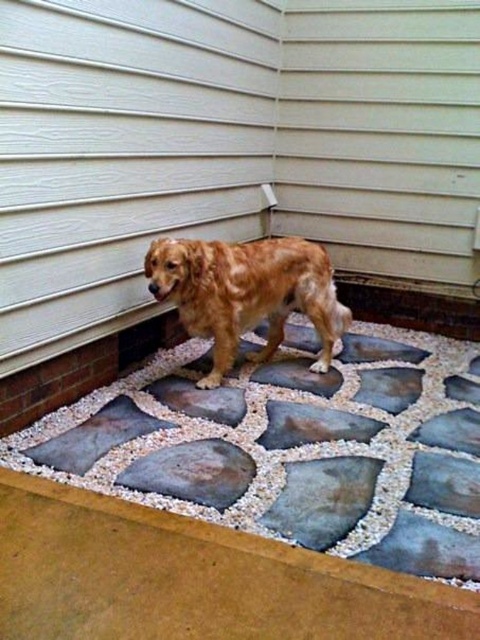
Question: Among these points, which one is nearest to the camera?

Choices:
 (A) (119, 26)
 (B) (223, 317)

Answer: (A)

Question: Can you confirm if white siding at upper left is positioned above golden fur dog at center?

Choices:
 (A) yes
 (B) no

Answer: (A)

Question: Is white siding at upper left to the right of golden fur dog at center from the viewer's perspective?

Choices:
 (A) no
 (B) yes

Answer: (A)

Question: Which point is farther to the camera?

Choices:
 (A) (269, 333)
 (B) (1, 253)

Answer: (A)

Question: Which point is closer to the camera taking this photo?

Choices:
 (A) (204, 84)
 (B) (315, 285)

Answer: (B)

Question: Is white siding at upper left wider than golden fur dog at center?

Choices:
 (A) yes
 (B) no

Answer: (A)